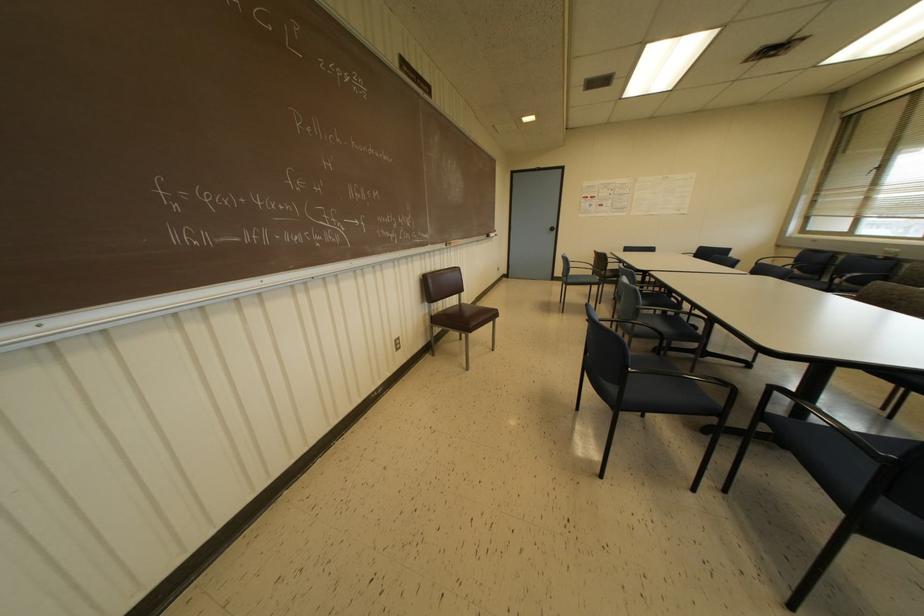
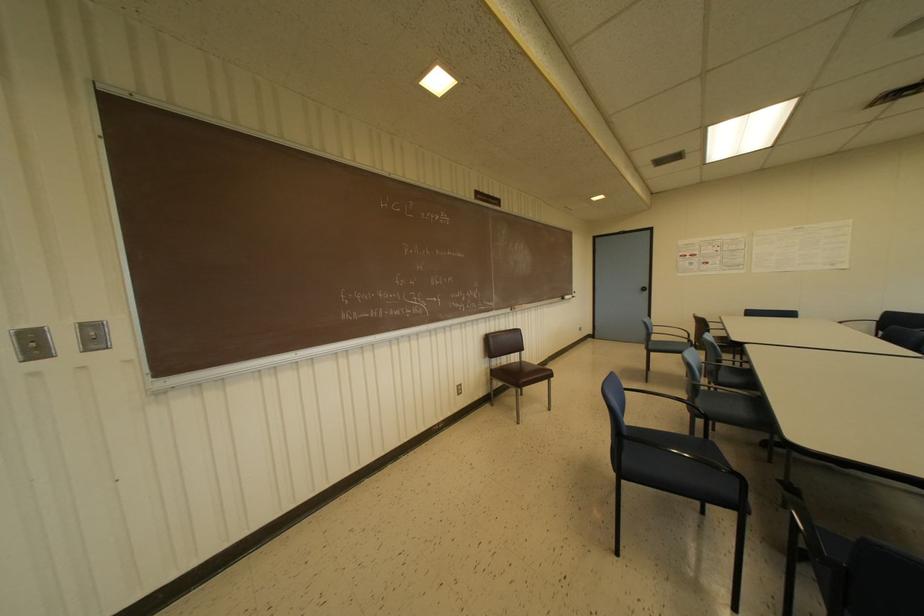
Find the pixel in the second image that matches (491,233) in the first image.

(565, 296)